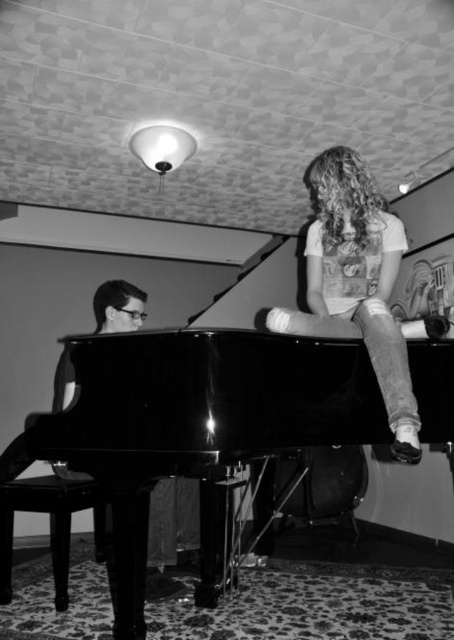
Question: Does black glossy piano at center have a lesser width compared to denim jeans at upper right?

Choices:
 (A) yes
 (B) no

Answer: (B)

Question: Considering the relative positions of black glossy piano at center and shiny black stool at lower left in the image provided, where is black glossy piano at center located with respect to shiny black stool at lower left?

Choices:
 (A) left
 (B) right

Answer: (B)

Question: Estimate the real-world distances between objects in this image. Which object is closer to the black glossy piano at center?

Choices:
 (A) denim jeans at upper right
 (B) shiny black stool at lower left

Answer: (A)

Question: Which of the following is the closest to the observer?

Choices:
 (A) denim jeans at upper right
 (B) shiny black stool at lower left

Answer: (A)

Question: Is black glossy piano at center to the left of shiny black stool at lower left from the viewer's perspective?

Choices:
 (A) yes
 (B) no

Answer: (B)

Question: Which is nearer to the denim jeans at upper right?

Choices:
 (A) black glossy piano at center
 (B) shiny black stool at lower left

Answer: (A)